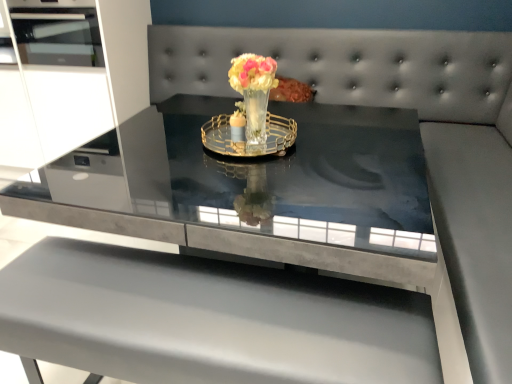
Locate an element on the screen. The image size is (512, 384). spots to the right of translucent glass vase at center is located at coordinates (314, 149).